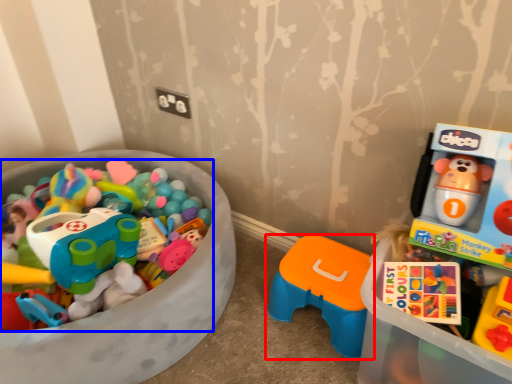
Question: Which object appears farthest to the camera in this image, toy (highlighted by a red box) or toy (highlighted by a blue box)?

Choices:
 (A) toy
 (B) toy

Answer: (A)